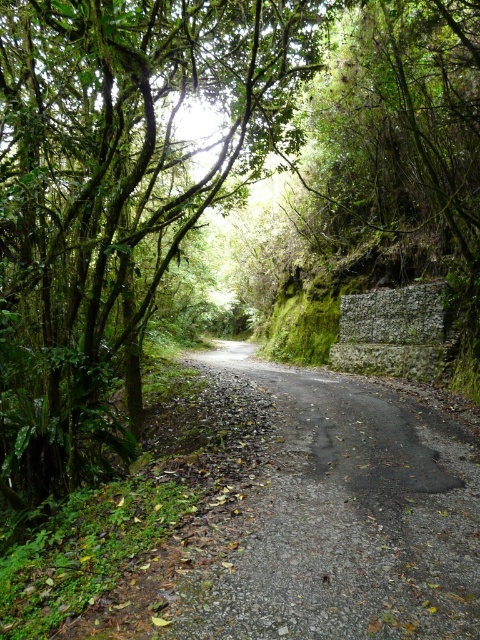
In the scene shown: You are a hiker trying to navigate the narrow road. You see the green leafy tree at center and the dark gray asphalt road at center. Which object is closer to your left side?

The green leafy tree at center is positioned on the left side of dark gray asphalt road at center, so it is closer to your left side.

You are a hiker standing on the dark gray asphalt road at center. You look up and see the green leafy tree at center. How does the height of the tree compare to the road?

The green leafy tree at center is taller than the dark gray asphalt road at center.

You are standing at the starting point of the road and want to locate the green leafy tree at center. Based on its 2D coordinates, in which direction should you look relative to your position?

The green leafy tree at center is located at coordinates 0.306 on the x axis and 0.240 on the y axis. Since the y coordinate is lower than 0.5, it means the tree is positioned closer to the top of the image. Therefore, you should look upward from your position to locate the green leafy tree at center.